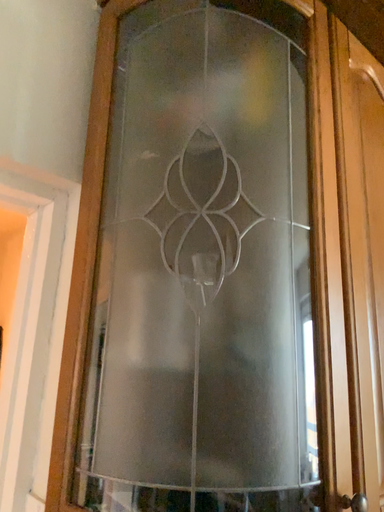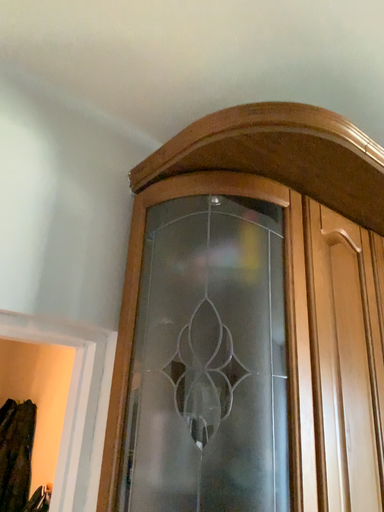
Question: Which way did the camera rotate in the video?

Choices:
 (A) rotated upward
 (B) rotated downward

Answer: (A)